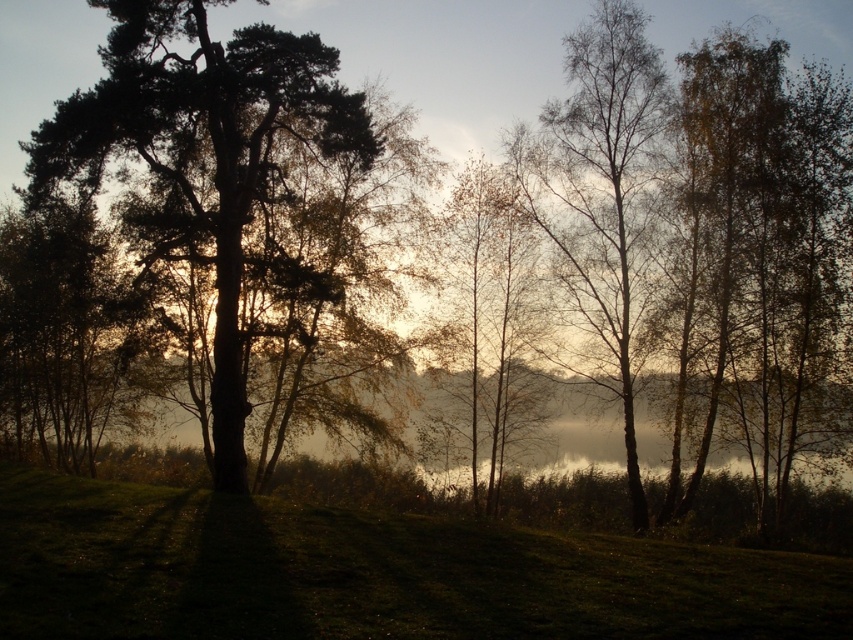
Question: Which object appears closest to the camera in this image?

Choices:
 (A) bare birch tree at right
 (B) green grassy hillside at lower center

Answer: (B)

Question: Is green grassy hillside at lower center thinner than dark green textured tree at left?

Choices:
 (A) yes
 (B) no

Answer: (B)

Question: In this image, where is dark green textured tree at left located relative to bare birch tree at right?

Choices:
 (A) above
 (B) below

Answer: (A)

Question: Which point is farther from the camera taking this photo?

Choices:
 (A) (321, 67)
 (B) (612, 33)

Answer: (B)

Question: Estimate the real-world distances between objects in this image. Which object is closer to the dark green textured tree at left?

Choices:
 (A) bare birch tree at right
 (B) green grassy hillside at lower center

Answer: (B)

Question: Is green grassy hillside at lower center to the right of bare birch tree at right from the viewer's perspective?

Choices:
 (A) no
 (B) yes

Answer: (A)